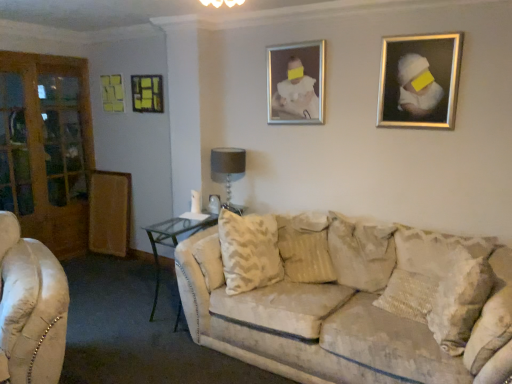
The width and height of the screenshot is (512, 384). I want to click on free space above silver metallic picture frame at upper center, the 3th picture frame when ordered from back to front (from a real-world perspective), so coord(293,38).